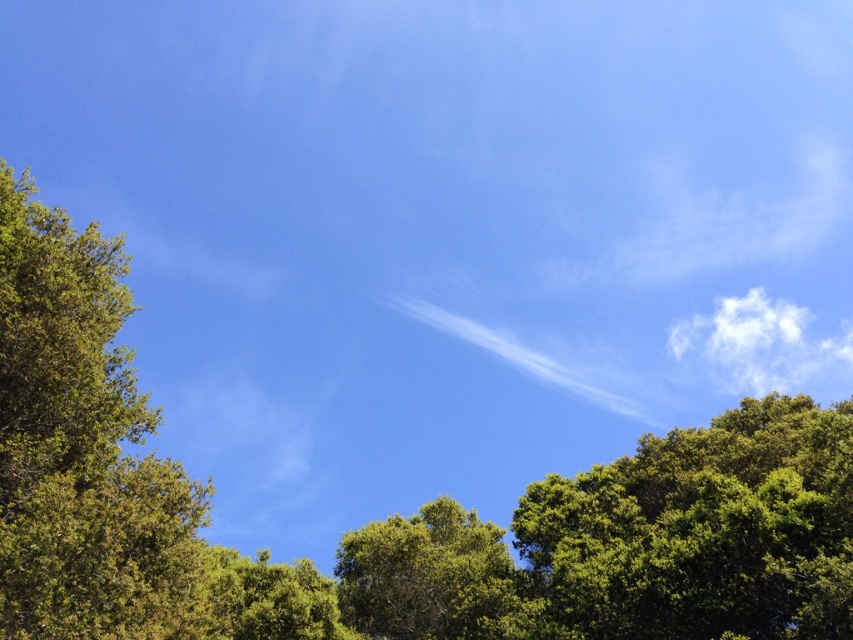
You are a bird seeking shelter. You see the green leafy tree at upper right and the green leafy tree at lower center. Which tree has a larger canopy to provide more shade?

The green leafy tree at upper right might be wider than green leafy tree at lower center, so it likely has a larger canopy to provide more shade.

You are a bird flying in the sky scene. You see the point marked at coordinates (701, 531). What object is located at that point?

The point at coordinates (701, 531) indicates a green leafy tree at upper right.

You are standing in a field looking at the sky scene described. There is a point marked at coordinates (80, 445). Based on the scene description, what object is located at this point?

The point at coordinates (80, 445) indicates the location of the green leafy tree at left.